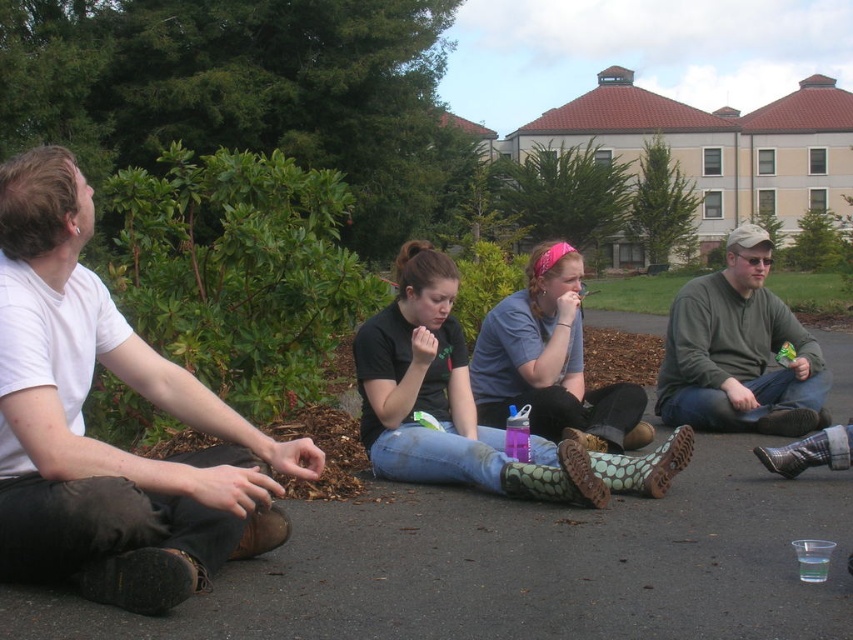
The height and width of the screenshot is (640, 853). What do you see at coordinates (738, 352) in the screenshot?
I see `dark gray sweater at center` at bounding box center [738, 352].

Who is positioned more to the right, dark gray sweater at center or denim jeans at center?

Positioned to the right is dark gray sweater at center.

Does point (714, 276) come in front of point (518, 392)?

No.

Locate an element on the screen. This screenshot has height=640, width=853. dark gray sweater at center is located at coordinates (738, 352).

Who is lower down, white cotton shirt at left or dark gray sweater at center?

white cotton shirt at left

Is point (82, 340) less distant than point (749, 316)?

That is True.

Is point (55, 234) closer to viewer compared to point (692, 291)?

Yes, point (55, 234) is in front of point (692, 291).

The height and width of the screenshot is (640, 853). What are the coordinates of `white cotton shirt at left` in the screenshot? It's located at (103, 442).

Does white cotton shirt at left come behind denim jeans at center?

No, white cotton shirt at left is in front of denim jeans at center.

What are the coordinates of `white cotton shirt at left` in the screenshot? It's located at (103, 442).

The image size is (853, 640). Find the location of `white cotton shirt at left`. white cotton shirt at left is located at coordinates (103, 442).